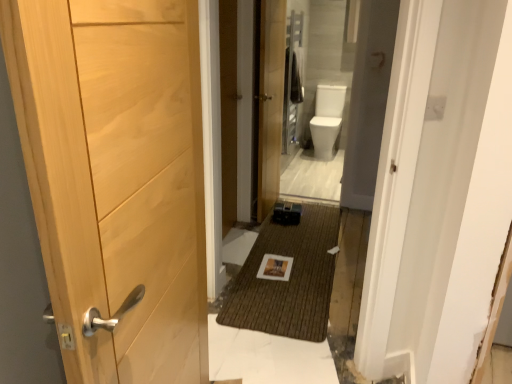
Question: In which direction should I rotate to look at wooden door at center, marked as the 2th door in a front-to-back arrangement?

Choices:
 (A) right
 (B) left

Answer: (A)

Question: Considering the relative positions of natural wood door at left, the 1th door from the left, and wooden door at center, the first door from the right, in the image provided, is natural wood door at left, the 1th door from the left, to the right of wooden door at center, the first door from the right, from the viewer's perspective?

Choices:
 (A) yes
 (B) no

Answer: (B)

Question: Is natural wood door at left, the 1th door from the left, positioned in front of wooden door at center, the first door from the right?

Choices:
 (A) yes
 (B) no

Answer: (A)

Question: Considering the relative positions of natural wood door at left, positioned as the first door in front-to-back order, and wooden door at center, the first door from the back, in the image provided, is natural wood door at left, positioned as the first door in front-to-back order, to the left of wooden door at center, the first door from the back, from the viewer's perspective?

Choices:
 (A) yes
 (B) no

Answer: (A)

Question: From a real-world perspective, does natural wood door at left, which appears as the 2th door when viewed from the back, stand above wooden door at center, the first door from the right?

Choices:
 (A) yes
 (B) no

Answer: (A)

Question: Is natural wood door at left, the 1th door from the left, next to wooden door at center, marked as the 2th door in a front-to-back arrangement?

Choices:
 (A) yes
 (B) no

Answer: (B)

Question: Can you confirm if natural wood door at left, positioned as the first door in front-to-back order, is wider than wooden door at center, the first door from the back?

Choices:
 (A) yes
 (B) no

Answer: (A)

Question: Could you tell me if wooden door at center, the first door from the right, is facing natural wood door at left, the 1th door from the left?

Choices:
 (A) yes
 (B) no

Answer: (B)

Question: Is wooden door at center, the first door from the right, looking in the opposite direction of natural wood door at left, the 1th door from the left?

Choices:
 (A) no
 (B) yes

Answer: (A)

Question: Is wooden door at center, the first door from the back, behind natural wood door at left, the 1th door from the left?

Choices:
 (A) no
 (B) yes

Answer: (B)

Question: From a real-world perspective, is wooden door at center, the first door from the right, physically above natural wood door at left, which appears as the 2th door when viewed from the back?

Choices:
 (A) no
 (B) yes

Answer: (A)

Question: From a real-world perspective, is wooden door at center, marked as the 2th door in a front-to-back arrangement, positioned under natural wood door at left, which appears as the 2th door when viewed from the back, based on gravity?

Choices:
 (A) no
 (B) yes

Answer: (B)

Question: From the image's perspective, would you say wooden door at center, the first door from the right, is shown under natural wood door at left, positioned as the first door in front-to-back order?

Choices:
 (A) yes
 (B) no

Answer: (B)

Question: Choose the correct answer: Is natural wood door at left, positioned as the first door in front-to-back order, inside wooden door at center, the first door from the right, or outside it?

Choices:
 (A) inside
 (B) outside

Answer: (B)